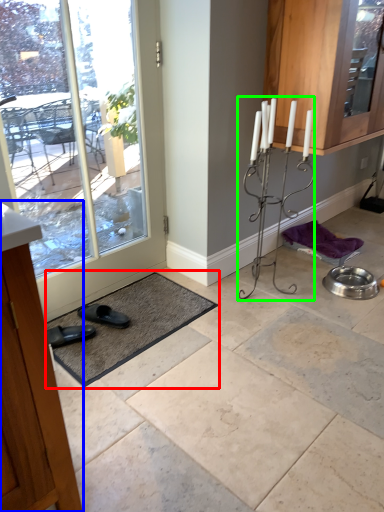
Question: Estimate the real-world distances between objects in this image. Which object is closer to bath mat (highlighted by a red box), cabinetry (highlighted by a blue box) or candle holder (highlighted by a green box)?

Choices:
 (A) cabinetry
 (B) candle holder

Answer: (B)